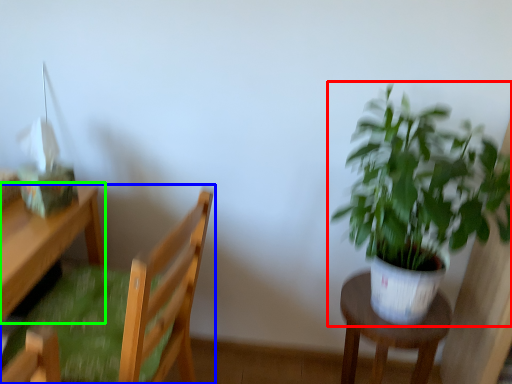
Question: Considering the real-world distances, which object is farthest from houseplant (highlighted by a red box)? chair (highlighted by a blue box) or desk (highlighted by a green box)?

Choices:
 (A) chair
 (B) desk

Answer: (B)